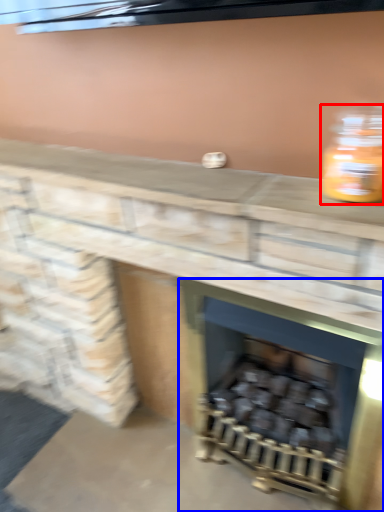
Question: Which of the following is the farthest to the observer, bottle (highlighted by a red box) or wood burning stove (highlighted by a blue box)?

Choices:
 (A) bottle
 (B) wood burning stove

Answer: (B)